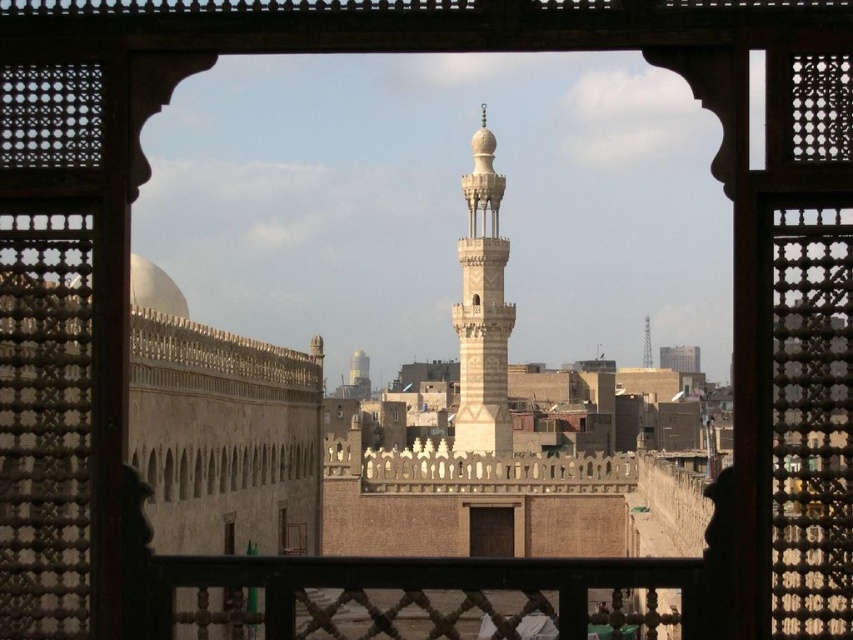
Based on the photo, you are an architect analyzing the historical urban landscape through the ornate wooden lattice window. You observe the white stone minaret at center and the smooth concrete tower at center. Which structure would require more materials to construct based on their sizes?

The white stone minaret at center has a larger size compared to the smooth concrete tower at center, so it would require more materials to construct.

You are standing in front of the ornate wooden lattice window and notice two points marked on the scene. The first point is at coordinates point (480, 145) and the second is at point (643, 353). Which of these points is nearer to your viewpoint?

Point (480, 145) is closer to the camera than point (643, 353), so the first point is nearer to your viewpoint.